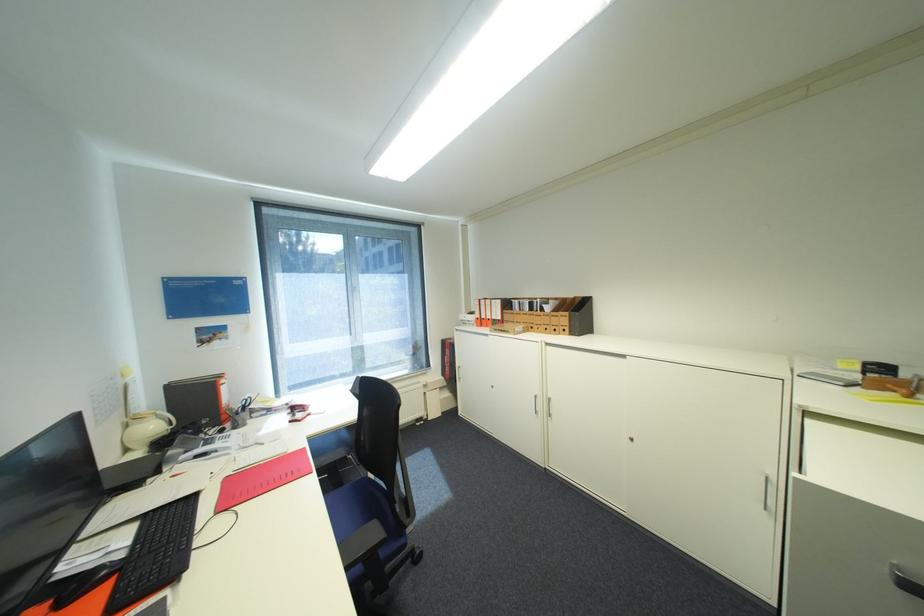
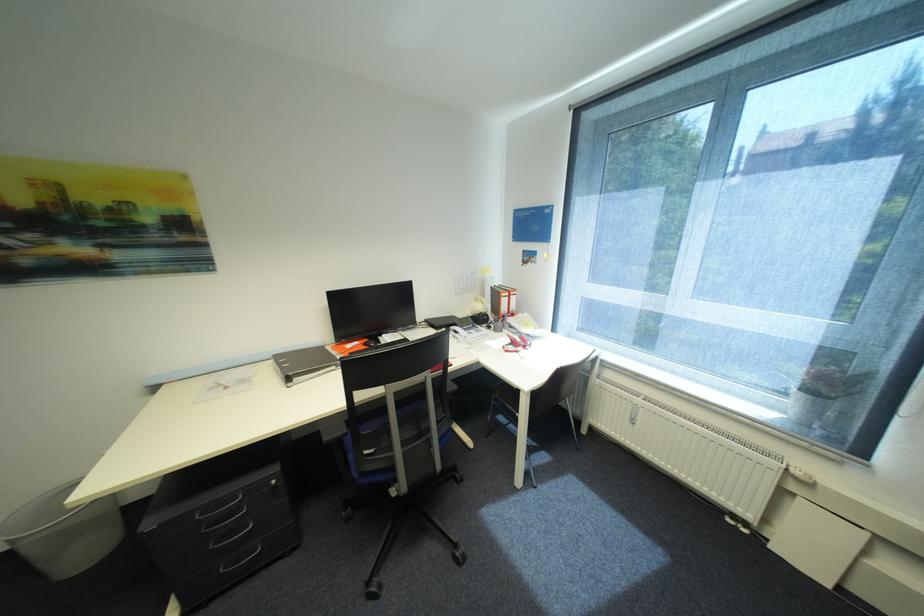
The point at (270, 416) is marked in the first image. Where is the corresponding point in the second image?

(521, 333)